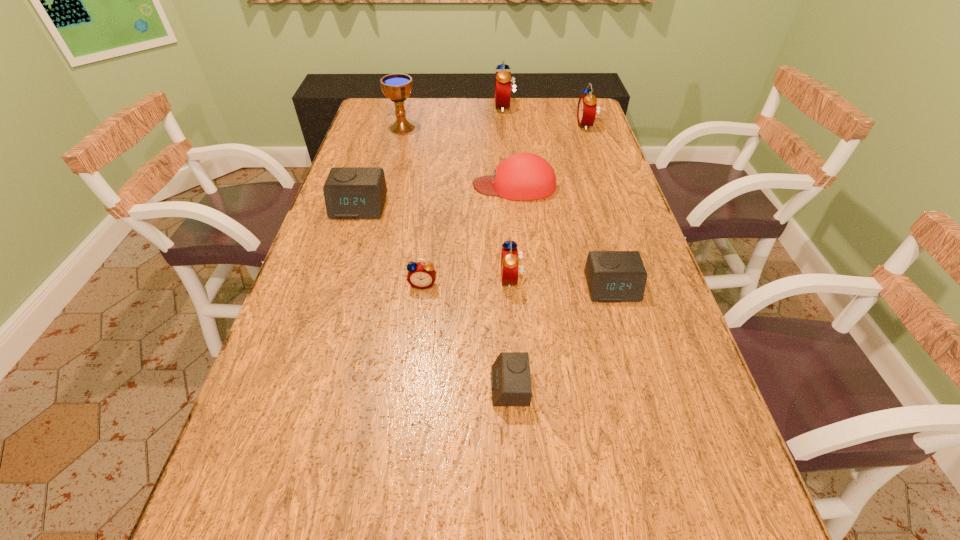
Identify the location of vacant space located on the front-facing side of the second smallest black alarm clock. The height and width of the screenshot is (540, 960). (653, 433).

Locate an element on the screen. The width and height of the screenshot is (960, 540). free space located 0.170m on the front-facing side of the nearest object is located at coordinates (405, 387).

Identify the location of vacant space situated 0.300m on the front-facing side of the nearest object. (339, 387).

The width and height of the screenshot is (960, 540). Identify the location of vacant space situated 0.120m on the front-facing side of the nearest object. (430, 387).

This screenshot has width=960, height=540. I want to click on chalice positioned at the far edge, so click(397, 87).

Where is `chalice situated at the left edge`? chalice situated at the left edge is located at coordinates (397, 87).

Locate an element on the screen. alarm clock positioned at the left edge is located at coordinates (350, 192).

At what (x,y) coordinates should I click in order to perform the action: click on object situated at the far left corner. Please return your answer as a coordinate pair (x, y). Looking at the image, I should click on (397, 87).

Find the location of `object that is positioned at the far right corner`. object that is positioned at the far right corner is located at coordinates (586, 112).

This screenshot has height=540, width=960. Find the location of `free spot at the far edge of the desktop`. free spot at the far edge of the desktop is located at coordinates (480, 119).